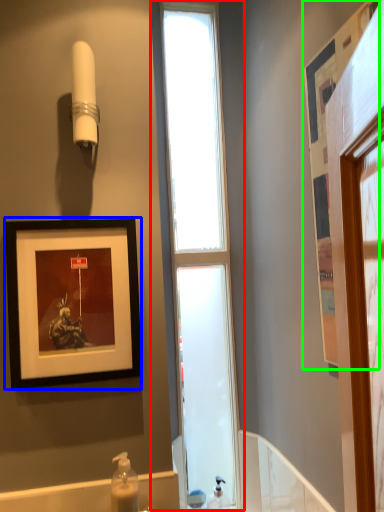
Question: Which is nearer to the window (highlighted by a red box)? picture frame (highlighted by a blue box) or picture frame (highlighted by a green box).

Choices:
 (A) picture frame
 (B) picture frame

Answer: (A)